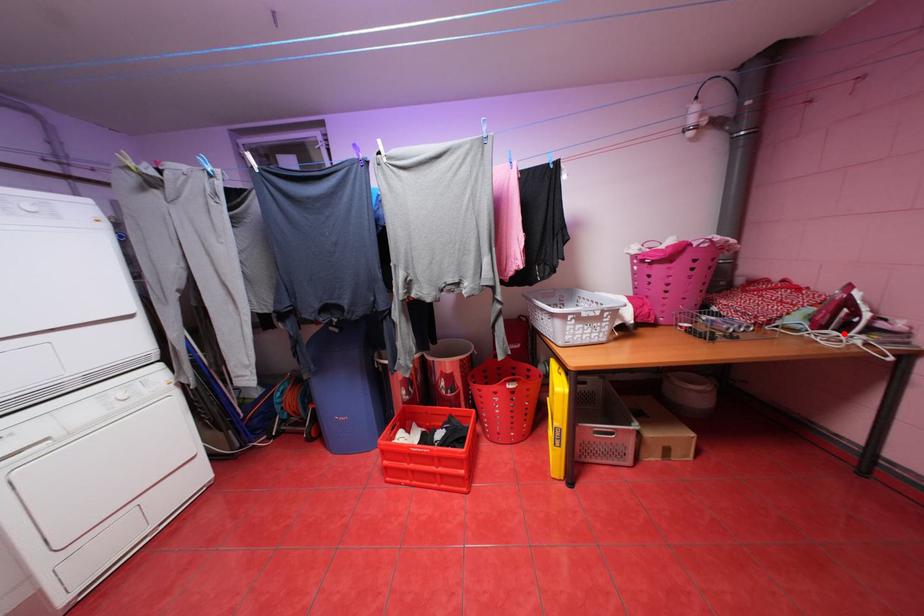
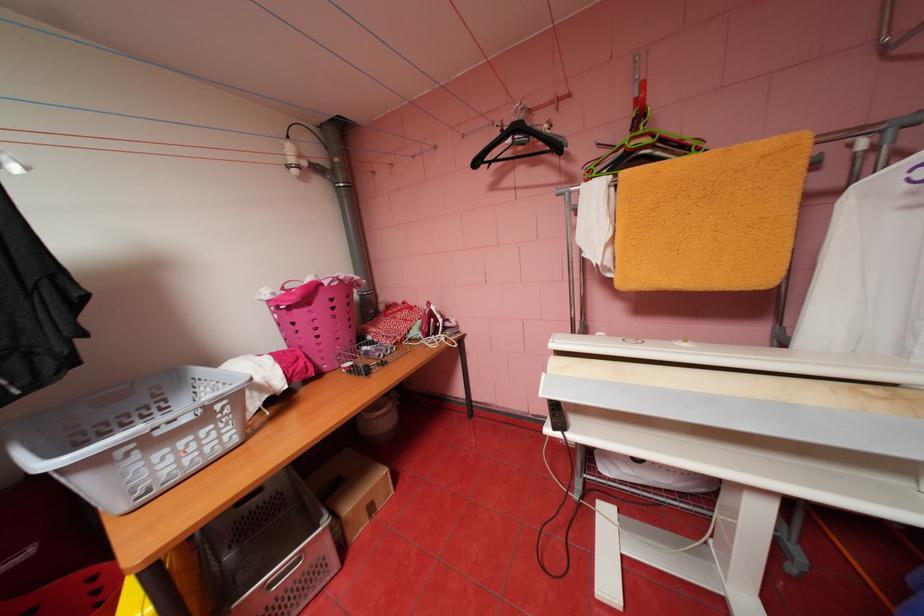
Find the pixel in the second image that matches the highlighted location in the first image.

(442, 337)